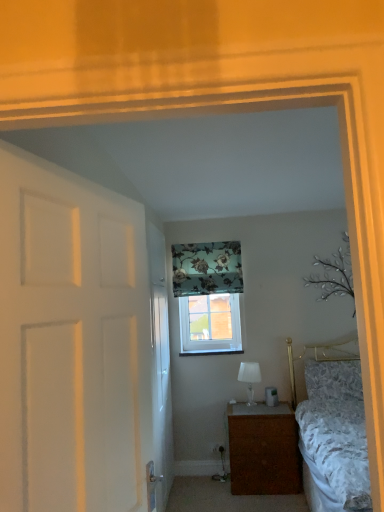
Question: Visually, is white glossy door at center, which is counted as the first door, starting from the back, positioned to the left or to the right of floral fabric curtain at upper center?

Choices:
 (A) right
 (B) left

Answer: (B)

Question: Do you think white glossy door at center, which is counted as the first door, starting from the back, is within floral fabric curtain at upper center, or outside of it?

Choices:
 (A) outside
 (B) inside

Answer: (A)

Question: Which object is positioned closest to the white glossy door at center, the 2th door positioned from the front?

Choices:
 (A) floral fabric curtain at upper center
 (B) white glossy table lamp at center
 (C) fluffy white pillow at right
 (D) clear glass window at center
 (E) brown wood nightstand at lower center

Answer: (D)

Question: Which is nearer to the clear glass window at center?

Choices:
 (A) white glossy table lamp at center
 (B) fluffy white pillow at right
 (C) brown wood nightstand at lower center
 (D) white matte door at left, the first door viewed from the front
 (E) white glossy door at center, which is counted as the first door, starting from the back

Answer: (E)